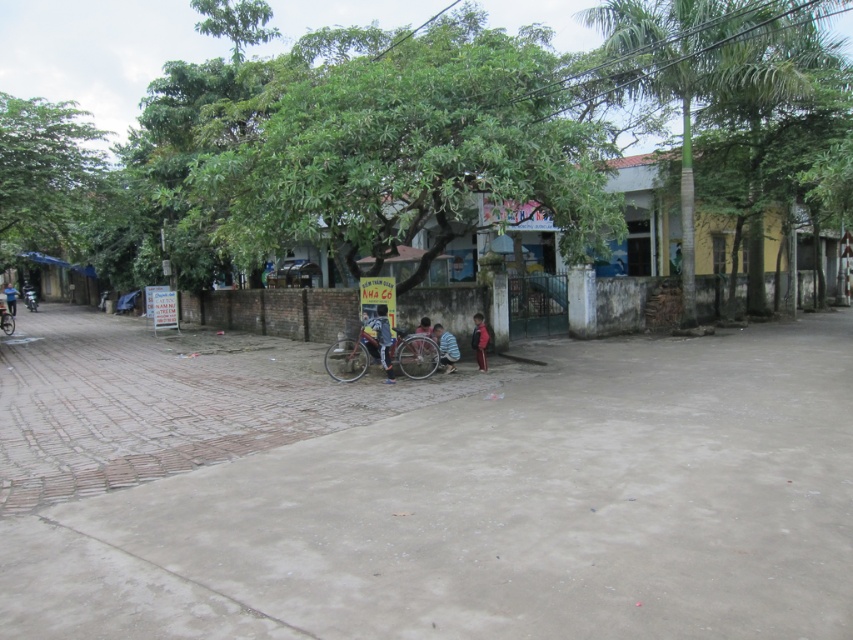
Does green leafy tree at upper center appear over blue denim jacket at left?

Indeed, green leafy tree at upper center is positioned over blue denim jacket at left.

Which of these two, green leafy tree at upper center or blue denim jacket at left, stands taller?

green leafy tree at upper center is taller.

Does point (705, 44) come in front of point (16, 292)?

Yes, point (705, 44) is closer to viewer.

Locate an element on the screen. The height and width of the screenshot is (640, 853). green leafy tree at upper center is located at coordinates (706, 65).

Between striped shirt at center and dark blue jeans at lower center, which one is positioned lower?

striped shirt at center is below.

Is point (445, 369) positioned after point (485, 358)?

No.

Find the location of a particular element. This screenshot has height=640, width=853. striped shirt at center is located at coordinates (445, 348).

Does denim jacket at center have a greater width compared to striped fabric shirt at center?

Indeed, denim jacket at center has a greater width compared to striped fabric shirt at center.

Is point (387, 342) farther from camera compared to point (416, 353)?

No, it is in front of (416, 353).

Who is more forward, (381, 333) or (424, 352)?

Point (381, 333) is more forward.

The image size is (853, 640). In order to click on denim jacket at center in this screenshot , I will do `click(381, 340)`.